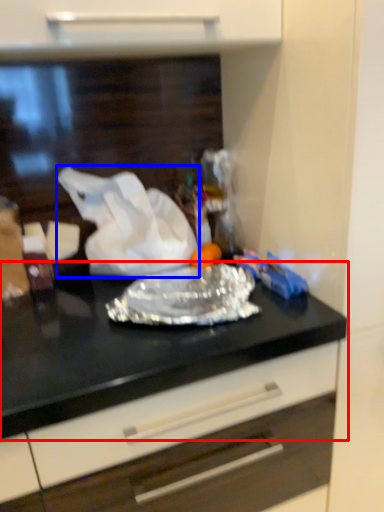
Question: Which object appears farthest to the camera in this image, countertop (highlighted by a red box) or wrapping paper (highlighted by a blue box)?

Choices:
 (A) countertop
 (B) wrapping paper

Answer: (B)